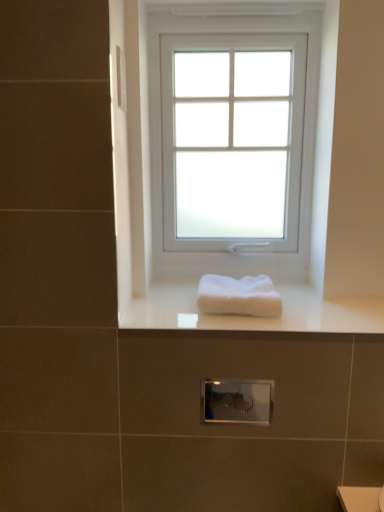
At what (x,y) coordinates should I click in order to perform the action: click on empty space that is ontop of white glossy towel at center (from a real-world perspective). Please return your answer as a coordinate pair (x, y). This screenshot has height=512, width=384. Looking at the image, I should click on (284, 314).